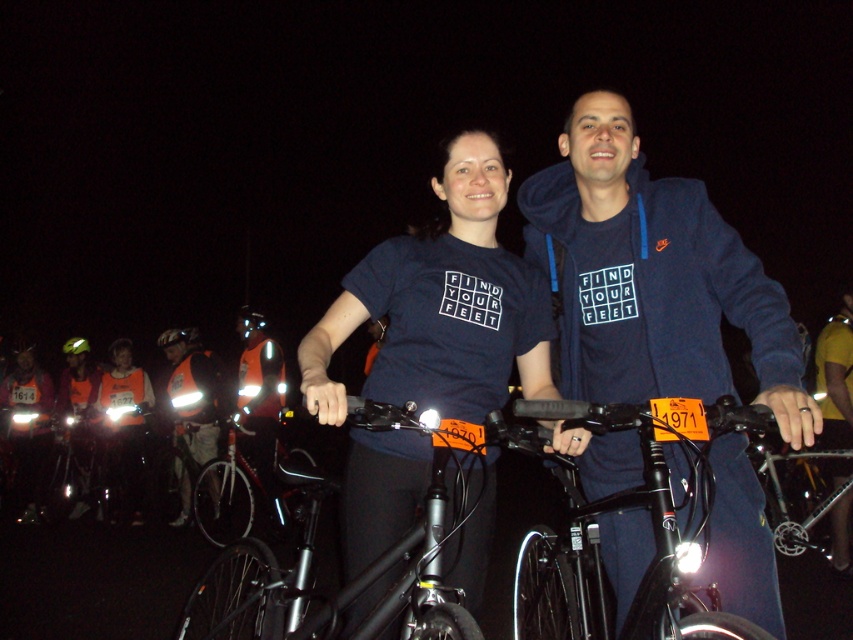
Question: Which of these objects is positioned closest to the black matte helmet at center?

Choices:
 (A) black metallic bicycle at center
 (B) green matte helmet at upper left

Answer: (B)

Question: Where is reflective orange vest at left located in relation to black matte helmet at center in the image?

Choices:
 (A) above
 (B) below

Answer: (B)

Question: Observing the image, what is the correct spatial positioning of dark blue t-shirt at center in reference to black matte helmet at center?

Choices:
 (A) right
 (B) left

Answer: (A)

Question: Based on their relative distances, which object is farther from the black matte helmet at center?

Choices:
 (A) green matte helmet at upper left
 (B) dark blue t-shirt at center
 (C) reflective orange vest at left
 (D) black metallic bicycle at center

Answer: (B)

Question: Among these objects, which one is farthest from the camera?

Choices:
 (A) green matte helmet at upper left
 (B) reflective orange vest at left
 (C) black matte helmet at center
 (D) navy blue hoodie at center

Answer: (A)

Question: Can you confirm if navy blue hoodie at center is bigger than green matte helmet at upper left?

Choices:
 (A) no
 (B) yes

Answer: (B)